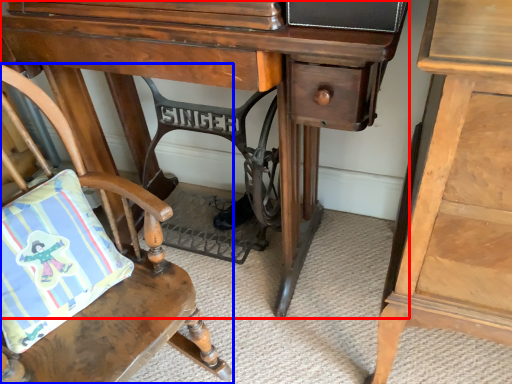
Question: Among these objects, which one is nearest to the camera, desk (highlighted by a red box) or chair (highlighted by a blue box)?

Choices:
 (A) desk
 (B) chair

Answer: (B)